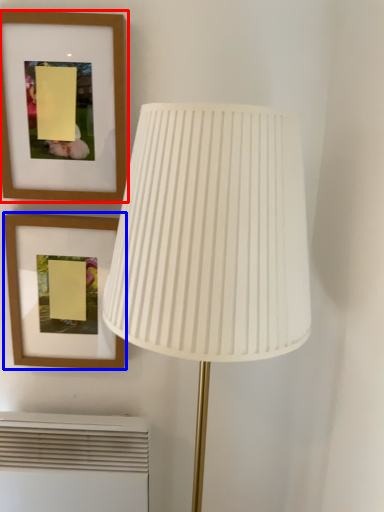
Question: Which object is further to the camera taking this photo, picture frame (highlighted by a red box) or picture frame (highlighted by a blue box)?

Choices:
 (A) picture frame
 (B) picture frame

Answer: (B)